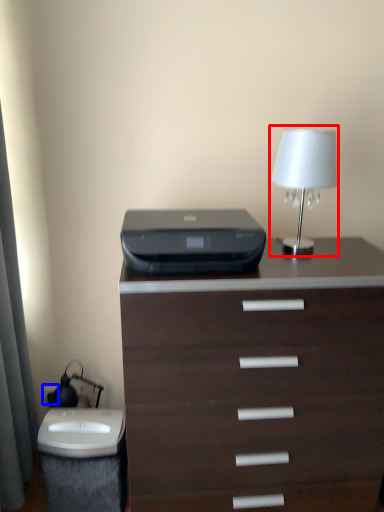
Question: Among these objects, which one is nearest to the camera, bedside lamp (highlighted by a red box) or electric outlet (highlighted by a blue box)?

Choices:
 (A) bedside lamp
 (B) electric outlet

Answer: (A)